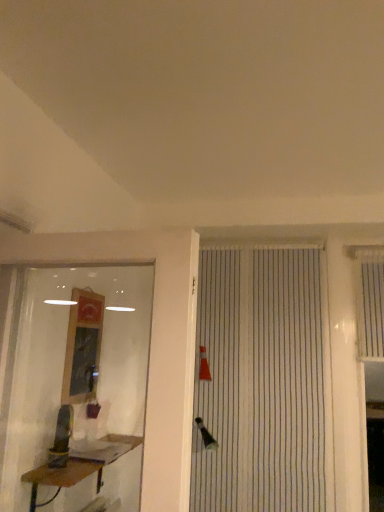
Question: From the image's perspective, is wooden framed mirror at left above brown wooden table at lower left?

Choices:
 (A) yes
 (B) no

Answer: (A)

Question: Does wooden framed mirror at left have a lesser width compared to brown wooden table at lower left?

Choices:
 (A) no
 (B) yes

Answer: (B)

Question: Is wooden framed mirror at left looking in the opposite direction of brown wooden table at lower left?

Choices:
 (A) no
 (B) yes

Answer: (A)

Question: Considering the relative positions of wooden framed mirror at left and brown wooden table at lower left in the image provided, is wooden framed mirror at left behind brown wooden table at lower left?

Choices:
 (A) no
 (B) yes

Answer: (B)

Question: Can you confirm if wooden framed mirror at left is positioned to the left of brown wooden table at lower left?

Choices:
 (A) no
 (B) yes

Answer: (B)

Question: In the image, is transparent glass shop window at left on the left side or the right side of white striped shutter at right?

Choices:
 (A) left
 (B) right

Answer: (A)

Question: Is point (84, 272) closer or farther from the camera than point (382, 328)?

Choices:
 (A) farther
 (B) closer

Answer: (B)

Question: From their relative heights in the image, would you say transparent glass shop window at left is taller or shorter than white striped shutter at right?

Choices:
 (A) short
 (B) tall

Answer: (B)

Question: Is transparent glass shop window at left wider or thinner than white striped shutter at right?

Choices:
 (A) wide
 (B) thin

Answer: (A)

Question: Considering the positions of white striped window blind at center and transparent glass shop window at left in the image, is white striped window blind at center wider or thinner than transparent glass shop window at left?

Choices:
 (A) wide
 (B) thin

Answer: (B)

Question: Based on their positions, is white striped window blind at center located to the left or right of transparent glass shop window at left?

Choices:
 (A) right
 (B) left

Answer: (A)

Question: Is white striped window blind at center taller or shorter than transparent glass shop window at left?

Choices:
 (A) short
 (B) tall

Answer: (B)

Question: Is white striped window blind at center in front of or behind transparent glass shop window at left in the image?

Choices:
 (A) behind
 (B) front

Answer: (A)

Question: Is transparent glass shop window at left bigger or smaller than brown wooden table at lower left?

Choices:
 (A) small
 (B) big

Answer: (B)

Question: From the image's perspective, is transparent glass shop window at left above or below brown wooden table at lower left?

Choices:
 (A) above
 (B) below

Answer: (A)